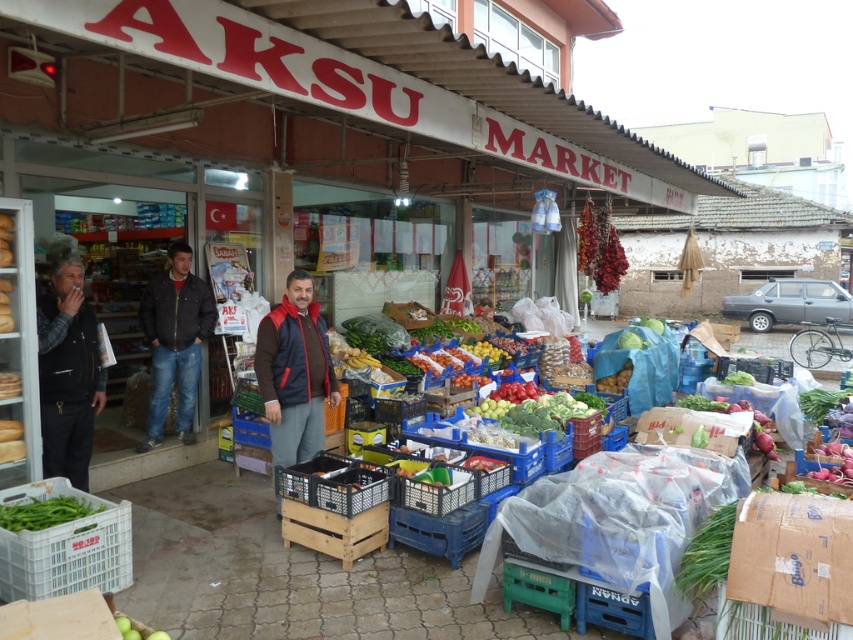
Question: Which point is closer to the camera?

Choices:
 (A) (91, 557)
 (B) (189, 355)
 (C) (277, 451)
 (D) (90, 426)

Answer: (A)

Question: Which object is farther from the camera taking this photo?

Choices:
 (A) dark gray jacket at left
 (B) dark blue jeans at center

Answer: (B)

Question: Does white plastic crate at lower left appear on the right side of brown/red jacket at center?

Choices:
 (A) no
 (B) yes

Answer: (A)

Question: Can you confirm if white plastic crate at lower left is smaller than green matte beans at lower left?

Choices:
 (A) yes
 (B) no

Answer: (B)

Question: Which point appears closest to the camera in this image?

Choices:
 (A) (49, 342)
 (B) (45, 504)

Answer: (B)

Question: Is dark gray jacket at left behind green matte beans at lower left?

Choices:
 (A) yes
 (B) no

Answer: (A)